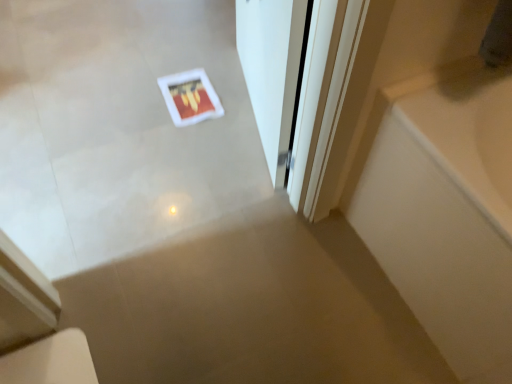
In order to click on white glossy door at center in this screenshot , I will do point(272,70).

Describe the element at coordinates (272, 70) in the screenshot. Image resolution: width=512 pixels, height=384 pixels. I see `white glossy door at center` at that location.

Locate an element on the screen. The image size is (512, 384). white glossy bathtub at right is located at coordinates (444, 209).

This screenshot has height=384, width=512. Describe the element at coordinates (444, 209) in the screenshot. I see `white glossy bathtub at right` at that location.

Where is `white glossy door at center`? white glossy door at center is located at coordinates [272, 70].

Can you confirm if white glossy door at center is positioned to the left of white glossy bathtub at right?

Yes, white glossy door at center is to the left of white glossy bathtub at right.

Which object is more forward, white glossy door at center or white glossy bathtub at right?

Positioned in front is white glossy bathtub at right.

Which is closer, (285,34) or (369,240)?

Point (285,34) appears to be closer to the viewer than point (369,240).

From the image's perspective, which is below, white glossy door at center or white glossy bathtub at right?

white glossy bathtub at right.

From a real-world perspective, who is located higher, white glossy door at center or white glossy bathtub at right?

white glossy door at center is physically above.

Between white glossy door at center and white glossy bathtub at right, which one has larger width?

With larger width is white glossy bathtub at right.

Between white glossy door at center and white glossy bathtub at right, which one has more height?

white glossy door at center is taller.

Which of these two, white glossy door at center or white glossy bathtub at right, is smaller?

white glossy door at center is smaller.

Is white glossy door at center completely or partially outside of white glossy bathtub at right?

white glossy door at center lies outside white glossy bathtub at right's area.

Is white glossy door at center positioned far away from white glossy bathtub at right?

No, white glossy door at center is not far away from white glossy bathtub at right.

Could you tell me if white glossy door at center is facing white glossy bathtub at right?

No, white glossy door at center is not aimed at white glossy bathtub at right.

You are a GUI agent. You are given a task and a screenshot of the screen. Output one action in this format:
    pyautogui.click(x=<x>, y=<y>)
    Task: Click on the door above the white glossy bathtub at right (from a real-world perspective)
    The height and width of the screenshot is (384, 512).
    Given the screenshot: What is the action you would take?
    pyautogui.click(x=272, y=70)

Between white glossy bathtub at right and white glossy door at center, which one appears on the right side from the viewer's perspective?

From the viewer's perspective, white glossy bathtub at right appears more on the right side.

Between white glossy bathtub at right and white glossy door at center, which one is positioned behind?

white glossy door at center is more distant.

Which is less distant, (x=454, y=277) or (x=244, y=59)?

Point (x=454, y=277).

From the image's perspective, is white glossy bathtub at right located above white glossy door at center?

No, from the image's perspective, white glossy bathtub at right is not over white glossy door at center.

In the scene shown: From a real-world perspective, between white glossy bathtub at right and white glossy door at center, who is vertically higher?

In real-world perspective, white glossy door at center is above.

Looking at their sizes, would you say white glossy bathtub at right is wider or thinner than white glossy door at center?

Considering their sizes, white glossy bathtub at right looks broader than white glossy door at center.

In terms of height, does white glossy bathtub at right look taller or shorter compared to white glossy door at center?

Clearly, white glossy bathtub at right is shorter compared to white glossy door at center.

Considering the sizes of objects white glossy bathtub at right and white glossy door at center in the image provided, who is bigger, white glossy bathtub at right or white glossy door at center?

white glossy bathtub at right.

Can we say white glossy bathtub at right lies outside white glossy door at center?

white glossy bathtub at right is positioned outside white glossy door at center.

Is white glossy bathtub at right positioned far away from white glossy door at center?

No, white glossy bathtub at right is not far away from white glossy door at center.

Is white glossy door at center at the back of white glossy bathtub at right?

No, white glossy bathtub at right's orientation is not away from white glossy door at center.

How much distance is there between white glossy bathtub at right and white glossy door at center?

46.51 centimeters.

Find the location of a particular element. The image size is (512, 384). bath below the white glossy door at center (from a real-world perspective) is located at coordinates 444,209.

Identify the location of bath lying below the white glossy door at center (from the image's perspective). (444, 209).

This screenshot has height=384, width=512. In the image, there is a white glossy bathtub at right. Identify the location of door above it (from the image's perspective). (272, 70).